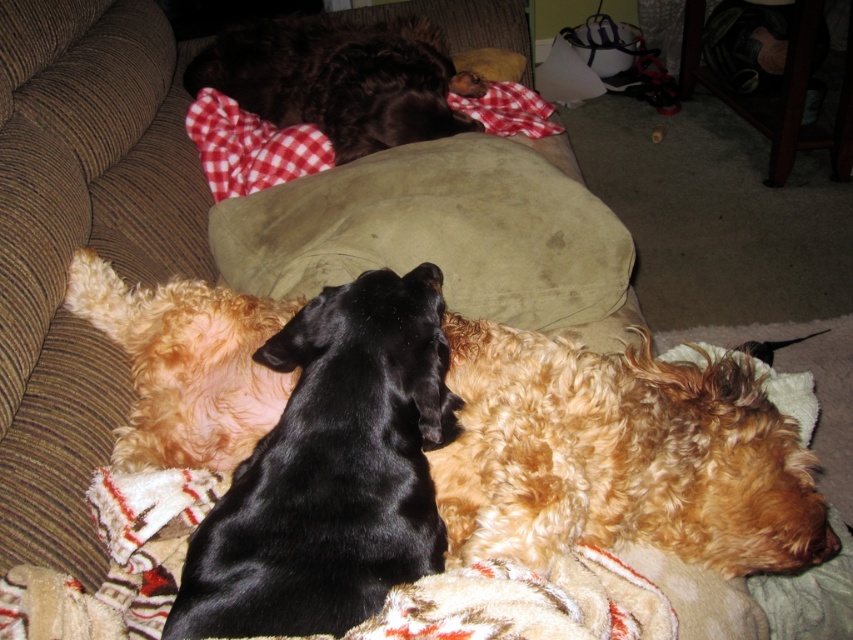
Who is taller, black smooth dog at center or curly golden fur at center?

Standing taller between the two is black smooth dog at center.

Which is in front, point (334, 596) or point (251, 332)?

Point (334, 596)

Where is `black smooth dog at center`? This screenshot has width=853, height=640. black smooth dog at center is located at coordinates (331, 470).

Is suede cushion at center further to the viewer compared to shiny brown fur at center?

No, suede cushion at center is closer to the viewer.

Between suede cushion at center and shiny brown fur at center, which one has more height?

With more height is shiny brown fur at center.

Describe the element at coordinates (436, 230) in the screenshot. I see `suede cushion at center` at that location.

Identify the location of suede cushion at center. (436, 230).

From the picture: Is black fur dog at center shorter than suede cushion at center?

In fact, black fur dog at center may be taller than suede cushion at center.

Looking at this image, who is higher up, black fur dog at center or suede cushion at center?

suede cushion at center is above.

The width and height of the screenshot is (853, 640). Identify the location of black fur dog at center. (619, 456).